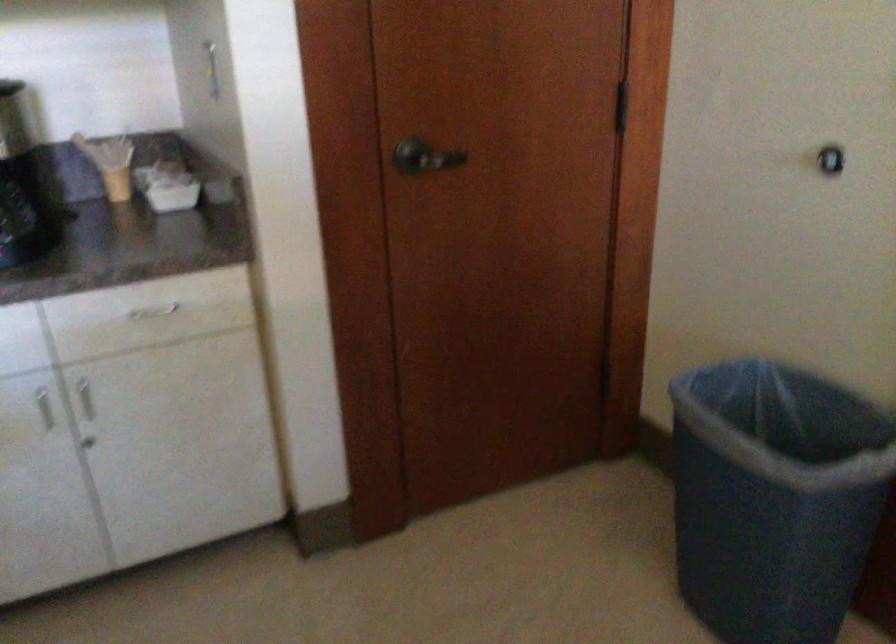
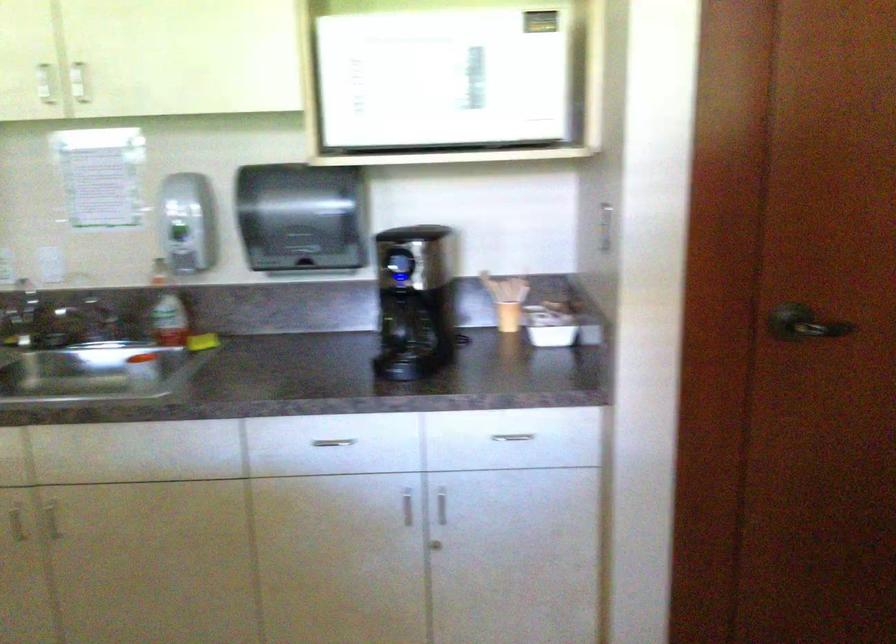
Find the pixel in the second image that matches point (82, 447) in the first image.

(435, 545)